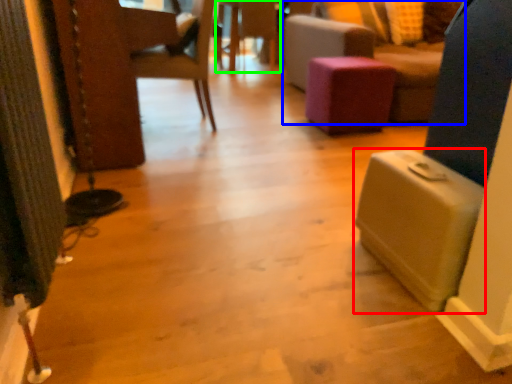
Question: Which object is positioned farthest from lift (highlighted by a red box)? Select from furniture (highlighted by a blue box) and side table (highlighted by a green box).

Choices:
 (A) furniture
 (B) side table

Answer: (B)